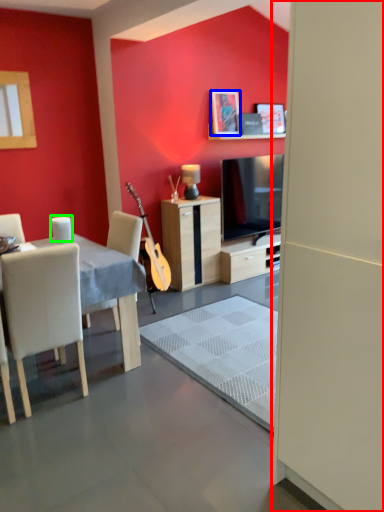
Question: Estimate the real-world distances between objects in this image. Which object is closer to screen door (highlighted by a red box), picture frame (highlighted by a blue box) or coffee cup (highlighted by a green box)?

Choices:
 (A) picture frame
 (B) coffee cup

Answer: (B)